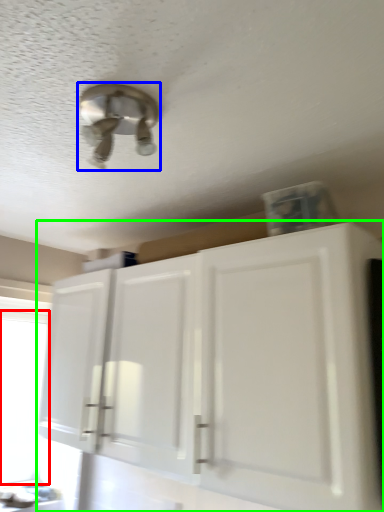
Question: Which object is positioned farthest from window screen (highlighted by a red box)? Select from light fixture (highlighted by a blue box) and cabinetry (highlighted by a green box).

Choices:
 (A) light fixture
 (B) cabinetry

Answer: (A)